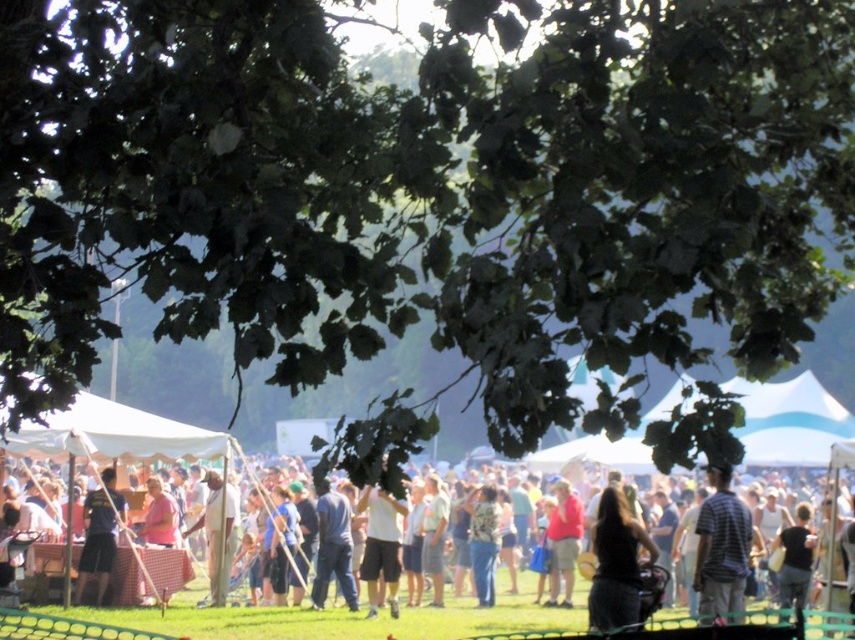
Can you confirm if dark blue jeans at center is positioned to the left of red shirt at center?

Yes, dark blue jeans at center is to the left of red shirt at center.

Consider the image. Is dark blue jeans at center in front of red shirt at center?

Yes, dark blue jeans at center is in front of red shirt at center.

Does point (833, 628) come in front of point (559, 550)?

Yes.

You are a GUI agent. You are given a task and a screenshot of the screen. Output one action in this format:
    pyautogui.click(x=<x>, y=<y>)
    Task: Click on the dark blue jeans at center
    This screenshot has width=855, height=640.
    Given the screenshot: What is the action you would take?
    pyautogui.click(x=308, y=624)

Between white fabric tent at center and white matte shirt at center, which one has less height?

Standing shorter between the two is white fabric tent at center.

The image size is (855, 640). I want to click on white fabric tent at center, so click(115, 435).

Between dark blue jeans at center and dark brown hair at center, which one appears on the right side from the viewer's perspective?

dark brown hair at center

Which is behind, point (260, 632) or point (590, 588)?

The point (260, 632) is behind.

Does point (500, 630) lie behind point (593, 589)?

That is True.

Find the location of a particular element. dark blue jeans at center is located at coordinates point(308,624).